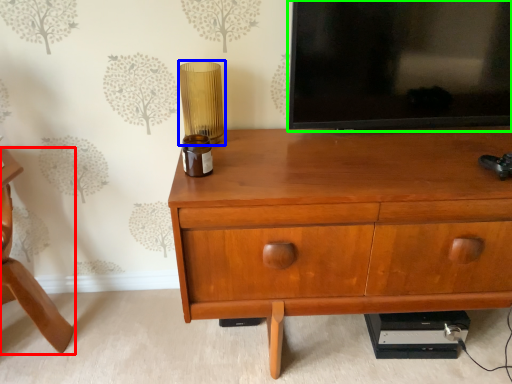
Question: Estimate the real-world distances between objects in this image. Which object is closer to furniture (highlighted by a red box), table lamp (highlighted by a blue box) or television (highlighted by a green box)?

Choices:
 (A) table lamp
 (B) television

Answer: (A)